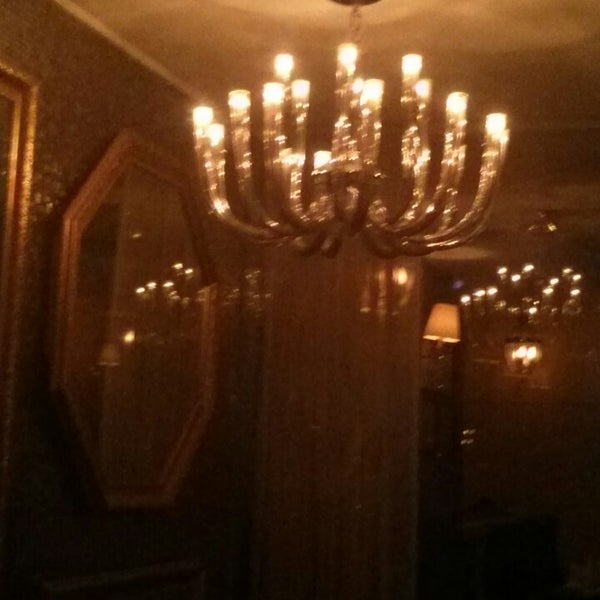
The width and height of the screenshot is (600, 600). Find the location of `table`. table is located at coordinates (438, 399).